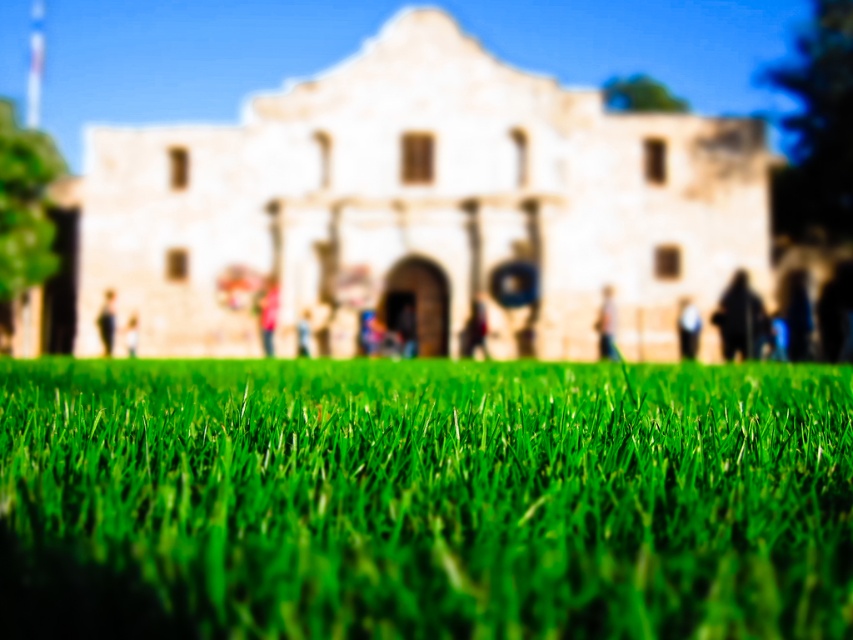
Question: Among these objects, which one is farthest from the camera?

Choices:
 (A) dark gray hoodie at center
 (B) green grass at lower center
 (C) light brown wooden person at center
 (D) light brown wooden chair at center

Answer: (C)

Question: Which point appears closest to the camera in this image?

Choices:
 (A) (606, 323)
 (B) (265, 346)

Answer: (A)

Question: Is matte pink shirt at center bigger than light brown wooden person at center?

Choices:
 (A) no
 (B) yes

Answer: (A)

Question: Does black matte person at center come in front of skinny jeans at lower left?

Choices:
 (A) yes
 (B) no

Answer: (A)

Question: Which of these objects is positioned farthest from the light brown leather jacket at center?

Choices:
 (A) light brown wooden chair at center
 (B) dark gray hoodie at center

Answer: (A)

Question: Is dark brown leather jacket at center thinner than light brown wooden person at center?

Choices:
 (A) yes
 (B) no

Answer: (A)